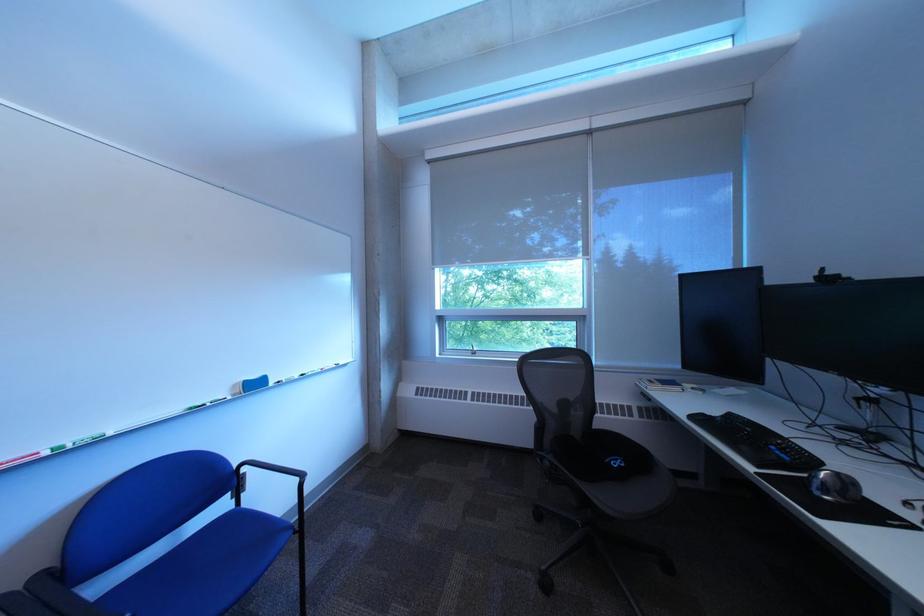
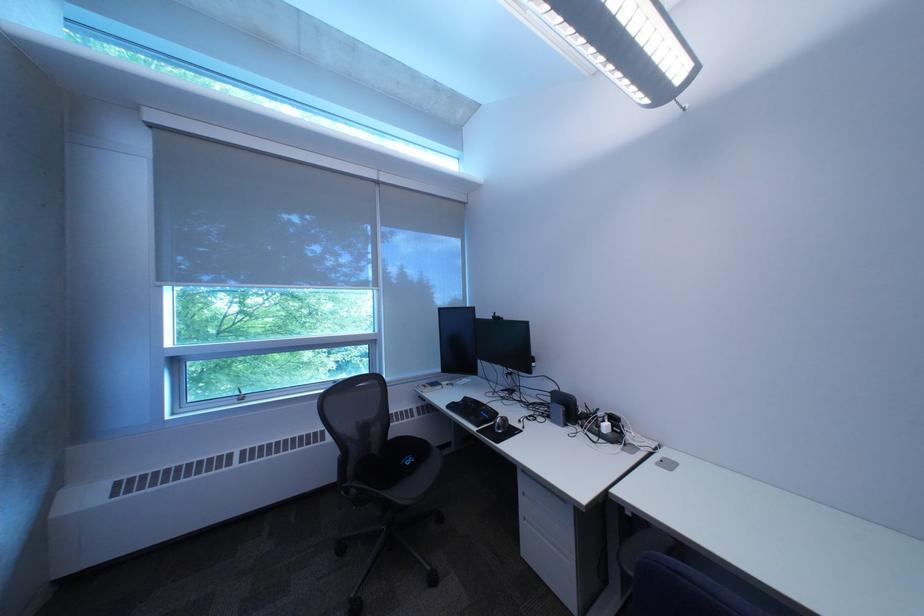
Find the pixel in the second image that matches the point at 631,462 in the first image.

(423, 461)